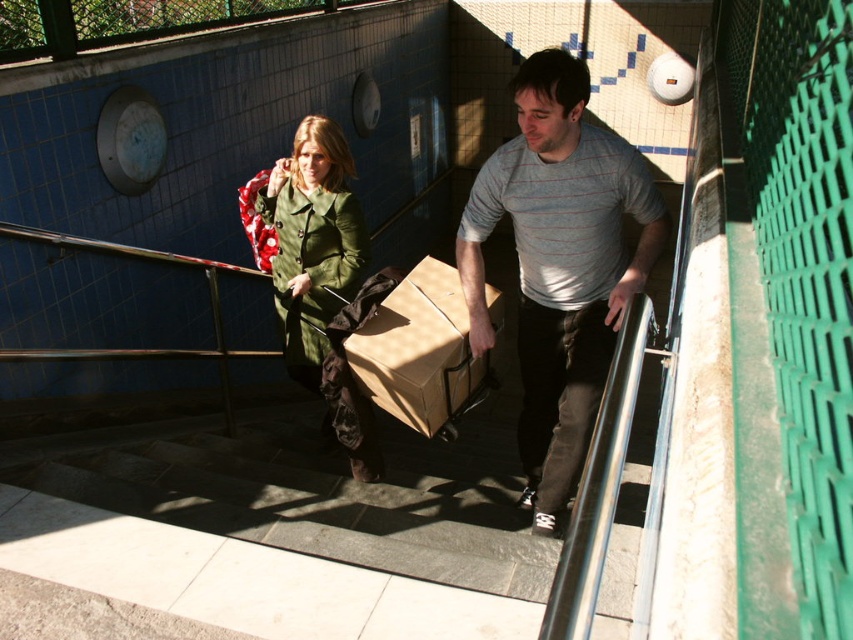
You are a security guard in the subway station depicted in the scene. You need to determine if the gray striped shirt at center can fit through a narrow doorway that the green matte coat at center can easily pass through. Based on their widths, what is your assessment?

The gray striped shirt at center is wider than the green matte coat at center, so it may not fit through the narrow doorway as easily as the green matte coat at center can.

You are a delivery person trying to navigate a staircase in a subway station. You see the green matte coat at center and the brown cardboard box at center. Which object is closer to you as you ascend the stairs?

The green matte coat at center is closer to you than the brown cardboard box at center because it is further to the viewer.

You are standing on the staircase in the image. There is a green matte coat at center. Where is the green matte coat located relative to the point at coordinates (318,275)?

The green matte coat at center is located exactly at the point with coordinates (318,275).